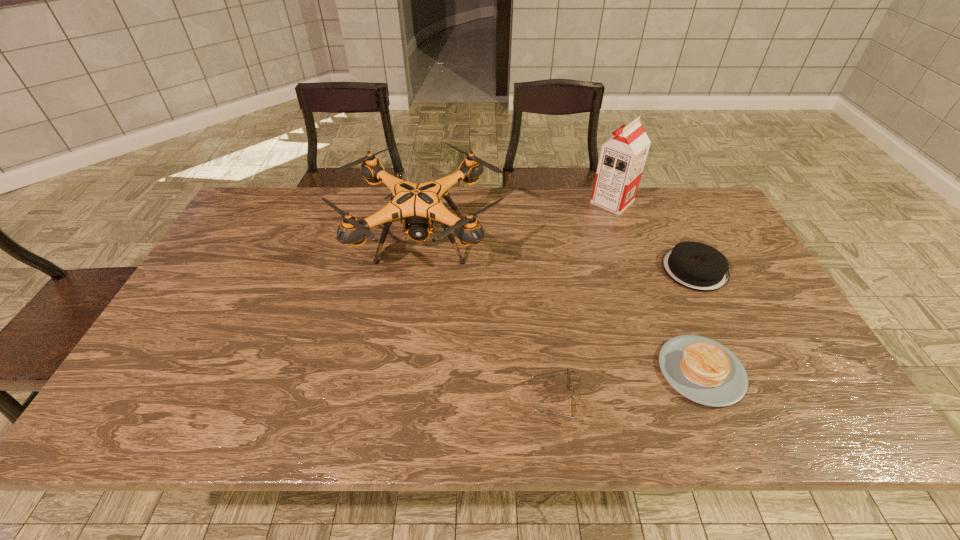
I want to click on free spot between the farther pancake and the nearer pancake, so click(x=698, y=320).

Image resolution: width=960 pixels, height=540 pixels. What are the coordinates of `free spot between the farther pancake and the tallest object` in the screenshot? It's located at (654, 235).

I want to click on vacant area that lies between the nearer pancake and the spectacles, so click(627, 385).

Locate an element on the screen. This screenshot has width=960, height=540. free space between the farther pancake and the soya milk is located at coordinates (654, 235).

Find the location of a particular element. Image resolution: width=960 pixels, height=540 pixels. free spot between the spectacles and the leftmost object is located at coordinates (488, 321).

This screenshot has height=540, width=960. What are the coordinates of `object that is the third closest one to the spectacles` in the screenshot? It's located at (694, 265).

Where is `object that is the nearest to the nearer pancake`? object that is the nearest to the nearer pancake is located at coordinates (694, 265).

Where is `free location that satisfies the following two spatial constraints: 1. on the front side of the nearer pancake; 2. on the front-facing side of the fourth object from right to left`? The height and width of the screenshot is (540, 960). free location that satisfies the following two spatial constraints: 1. on the front side of the nearer pancake; 2. on the front-facing side of the fourth object from right to left is located at coordinates click(x=713, y=399).

Locate an element on the screen. free point that satisfies the following two spatial constraints: 1. on the camera mount of the second tallest object; 2. on the left side of the nearer pancake is located at coordinates (404, 370).